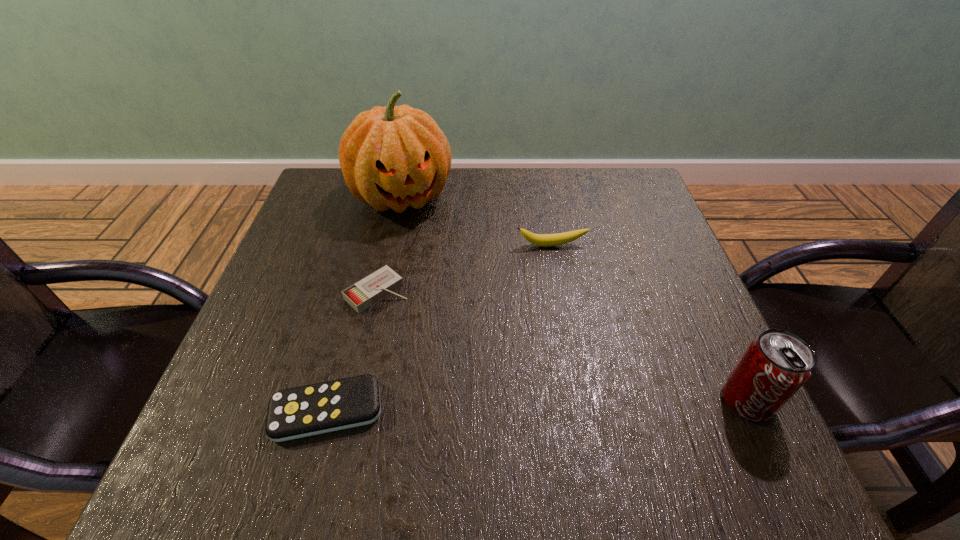
Where is `free area in between the banana and the remote control`? free area in between the banana and the remote control is located at coordinates (440, 328).

Image resolution: width=960 pixels, height=540 pixels. What are the coordinates of `free space between the shortest object and the fourth nearest object` in the screenshot? It's located at (440, 328).

The width and height of the screenshot is (960, 540). I want to click on object that stands as the second closest to the shortest object, so click(x=393, y=157).

Locate which object ranks in proximity to the farthest object. Please provide its 2D coordinates. Your answer should be formatted as a tuple, i.e. [(x, y)], where the tuple contains the x and y coordinates of a point satisfying the conditions above.

[(373, 288)]

Find the location of a particular element. vacant point that satisfies the following two spatial constraints: 1. on the back side of the third nearest object; 2. on the left side of the shortest object is located at coordinates (358, 292).

This screenshot has height=540, width=960. I want to click on vacant space that satisfies the following two spatial constraints: 1. on the front side of the farthest object; 2. on the left side of the rightmost object, so click(x=357, y=400).

Locate an element on the screen. vacant region that satisfies the following two spatial constraints: 1. on the back side of the third shortest object; 2. on the left side of the remote control is located at coordinates (371, 245).